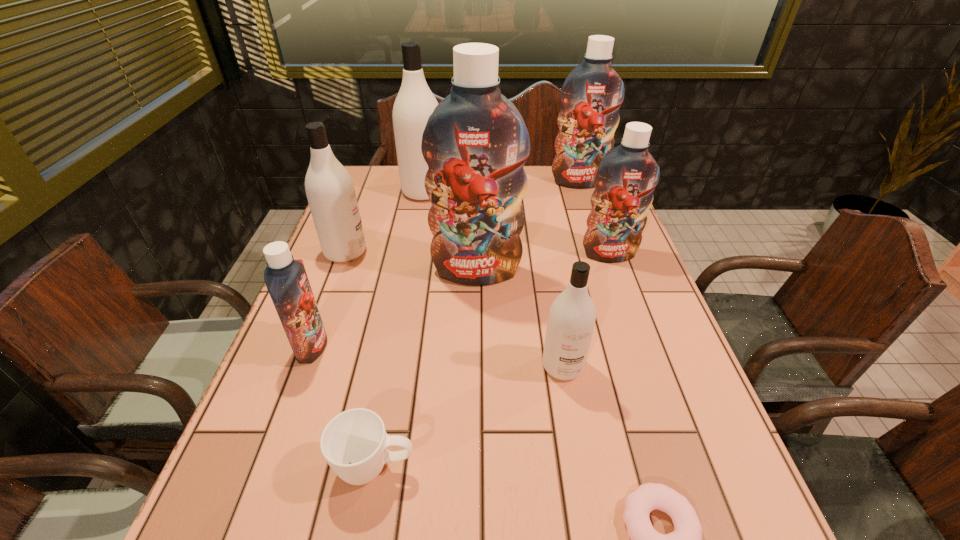
Identify the location of the third blue shampoo from right to left. (475, 142).

You are a GUI agent. You are given a task and a screenshot of the screen. Output one action in this format:
    pyautogui.click(x=<x>, y=<y>)
    Task: Click on the tallest object
    This screenshot has height=540, width=960.
    Given the screenshot: What is the action you would take?
    pyautogui.click(x=475, y=142)

Locate an element on the screen. This screenshot has width=960, height=540. the farthest white shampoo is located at coordinates (415, 102).

Identify the location of the second white shampoo from left to right. The height and width of the screenshot is (540, 960). (415, 102).

Where is `the second biggest blue shampoo`? This screenshot has width=960, height=540. the second biggest blue shampoo is located at coordinates (591, 96).

The width and height of the screenshot is (960, 540). Find the location of `the second biggest white shampoo`. the second biggest white shampoo is located at coordinates pos(330,191).

Find the location of a particular element. the leftmost white shampoo is located at coordinates (330, 191).

The image size is (960, 540). I want to click on the second smallest blue shampoo, so click(x=625, y=180).

This screenshot has width=960, height=540. I want to click on the smallest blue shampoo, so click(286, 279).

Identify the location of the leftmost blue shampoo. The width and height of the screenshot is (960, 540). (286, 279).